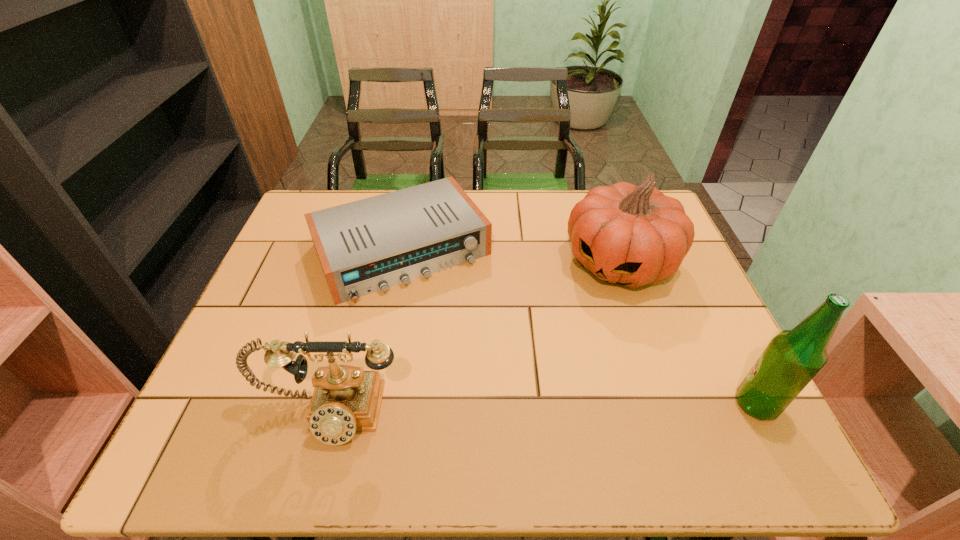
Find the location of a particular element. The height and width of the screenshot is (540, 960). telephone is located at coordinates (346, 399).

The image size is (960, 540). Find the location of `beer bottle`. beer bottle is located at coordinates (792, 359).

Find the location of a particular element. pumpkin is located at coordinates (632, 235).

This screenshot has height=540, width=960. Identify the location of radio receiver. click(x=365, y=246).

Identify the location of vacant space located 0.200m on the label of the beer bottle. The width and height of the screenshot is (960, 540). (638, 404).

This screenshot has height=540, width=960. Identify the location of free location located on the label of the beer bottle. (658, 404).

What are the coordinates of `vacant space located on the label of the beer bottle` in the screenshot? It's located at (701, 404).

This screenshot has height=540, width=960. Find the location of `vacant region located 0.280m on the face of the pumpkin`. vacant region located 0.280m on the face of the pumpkin is located at coordinates (541, 370).

Identify the location of vacant space located 0.050m on the face of the pumpkin. Image resolution: width=960 pixels, height=540 pixels. (588, 307).

What are the coordinates of `blank space located 0.350m on the face of the pumpkin` in the screenshot? It's located at (525, 393).